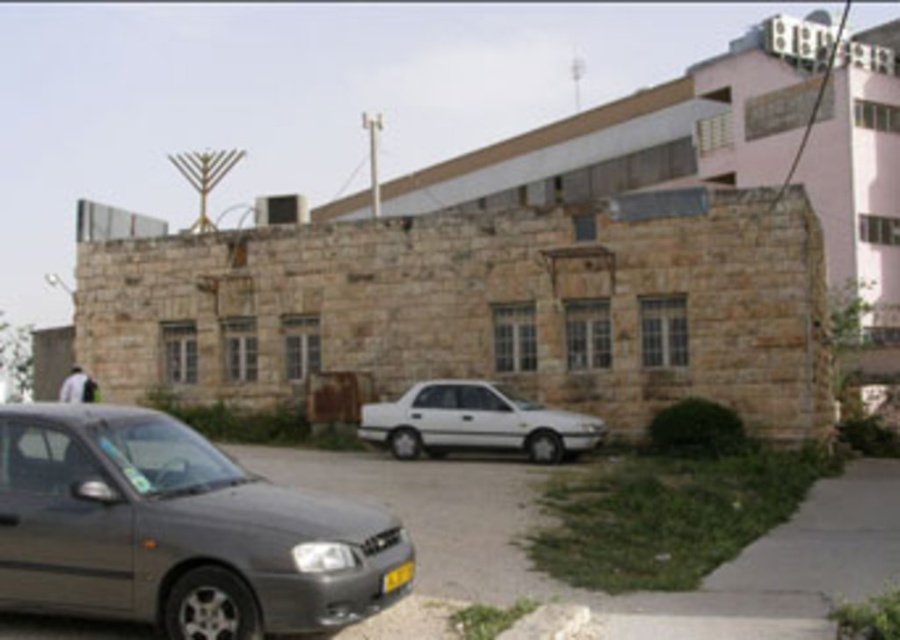
Question: Which object appears farthest from the camera in this image?

Choices:
 (A) yellow matte license plate at center
 (B) metallic gray sedan at lower left

Answer: (A)

Question: Which of the following is the closest to the observer?

Choices:
 (A) (405, 445)
 (B) (198, 467)

Answer: (B)

Question: Does metallic gray sedan at lower left appear on the right side of white matte sedan at center?

Choices:
 (A) no
 (B) yes

Answer: (A)

Question: Is white matte sedan at center further to camera compared to yellow matte license plate at center?

Choices:
 (A) yes
 (B) no

Answer: (A)

Question: Does metallic gray sedan at lower left appear under white matte sedan at center?

Choices:
 (A) no
 (B) yes

Answer: (B)

Question: Which object is farther from the camera taking this photo?

Choices:
 (A) metallic gray sedan at lower left
 (B) yellow matte license plate at center

Answer: (B)